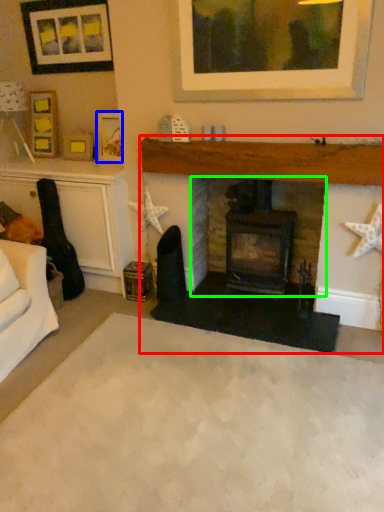
Question: Which is farther away from fireplace (highlighted by a red box)? picture frame (highlighted by a blue box) or fireplace (highlighted by a green box)?

Choices:
 (A) picture frame
 (B) fireplace

Answer: (A)